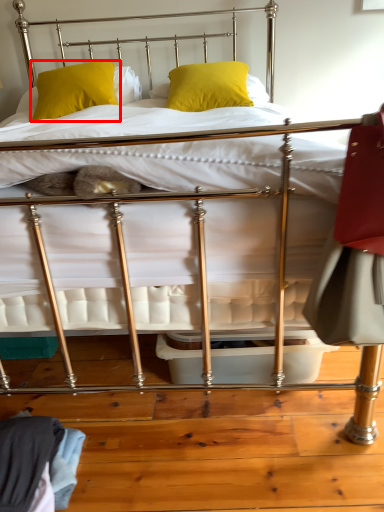
Question: From the image's perspective, what is the correct spatial relationship of pillow (annotated by the red box) in relation to pillow?

Choices:
 (A) above
 (B) below

Answer: (B)